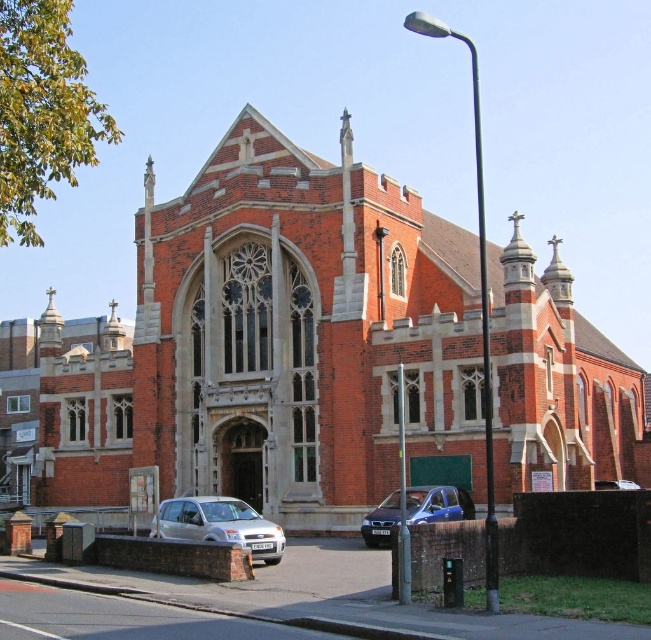
Can you confirm if red brick church at center is positioned below silver metallic hatchback at lower left?

No, red brick church at center is not below silver metallic hatchback at lower left.

Can you confirm if red brick church at center is wider than silver metallic hatchback at lower left?

Correct, the width of red brick church at center exceeds that of silver metallic hatchback at lower left.

You are a GUI agent. You are given a task and a screenshot of the screen. Output one action in this format:
    pyautogui.click(x=<x>, y=<y>)
    Task: Click on the red brick church at center
    This screenshot has width=651, height=640.
    Given the screenshot: What is the action you would take?
    pyautogui.click(x=273, y=346)

At what (x,y) coordinates should I click in order to perform the action: click on red brick church at center. Please return your answer as a coordinate pair (x, y). Looking at the image, I should click on point(273,346).

Can you confirm if red brick church at center is taller than metallic blue car at lower center?

Correct, red brick church at center is much taller as metallic blue car at lower center.

Is red brick church at center wider than metallic blue car at lower center?

Yes.

Is point (130, 358) positioned behind point (452, 500)?

Yes, point (130, 358) is farther from viewer.

Where is `red brick church at center`? Image resolution: width=651 pixels, height=640 pixels. red brick church at center is located at coordinates (273, 346).

Does silver metallic hatchback at lower left appear over metallic blue car at lower center?

Incorrect, silver metallic hatchback at lower left is not positioned above metallic blue car at lower center.

Does silver metallic hatchback at lower left lie in front of metallic blue car at lower center?

Yes, silver metallic hatchback at lower left is closer to the viewer.

Does point (173, 516) come in front of point (389, 536)?

Yes, point (173, 516) is in front of point (389, 536).

Image resolution: width=651 pixels, height=640 pixels. I want to click on silver metallic hatchback at lower left, so click(219, 524).